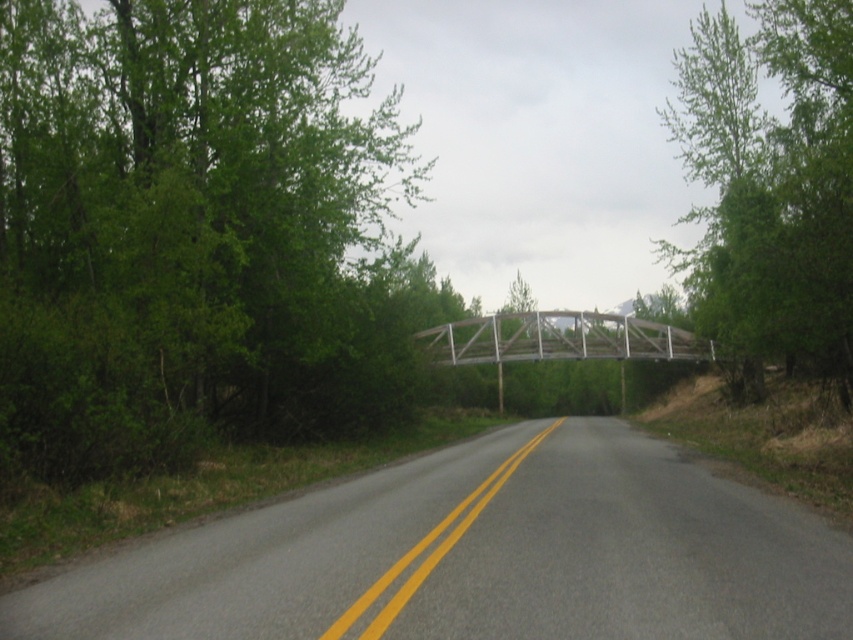
You are a driver approaching the green leafy tree at left and the asphalt road at center. Which object would appear closer to you as you drive forward?

The green leafy tree at left would appear closer because it is larger in size than the asphalt road at center, indicating it is nearer to the observer.

You are standing at the center of the road and looking towards the direction of the metal truss bridge. Which side of the road does the green leafy tree at left appear on?

The green leafy tree at left is located at point coordinates of (193, 232), so it appears on the left side of the road from your perspective.